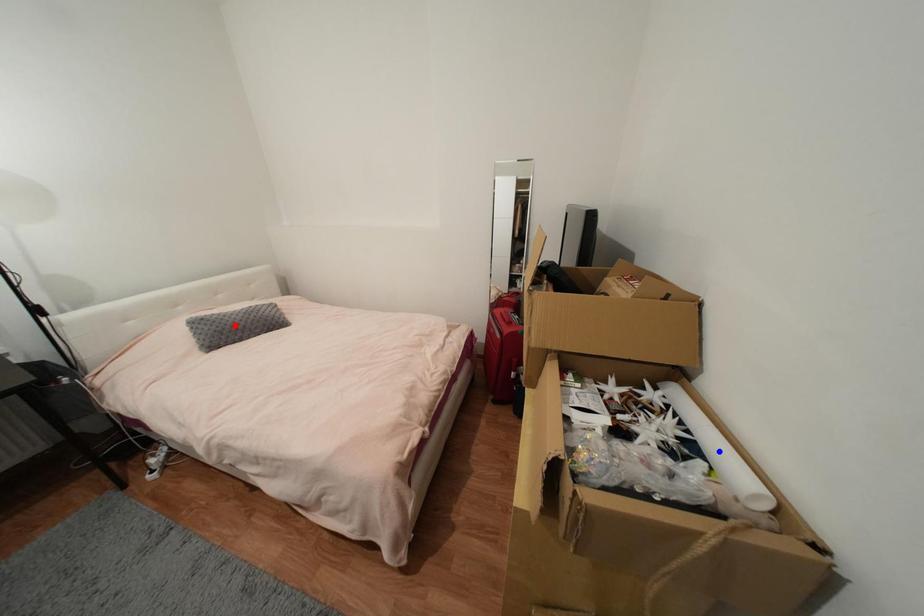
Question: In the image, two points are highlighted. Which point is nearer to the camera? Reply with the corresponding letter.

Choices:
 (A) blue point
 (B) red point

Answer: (A)